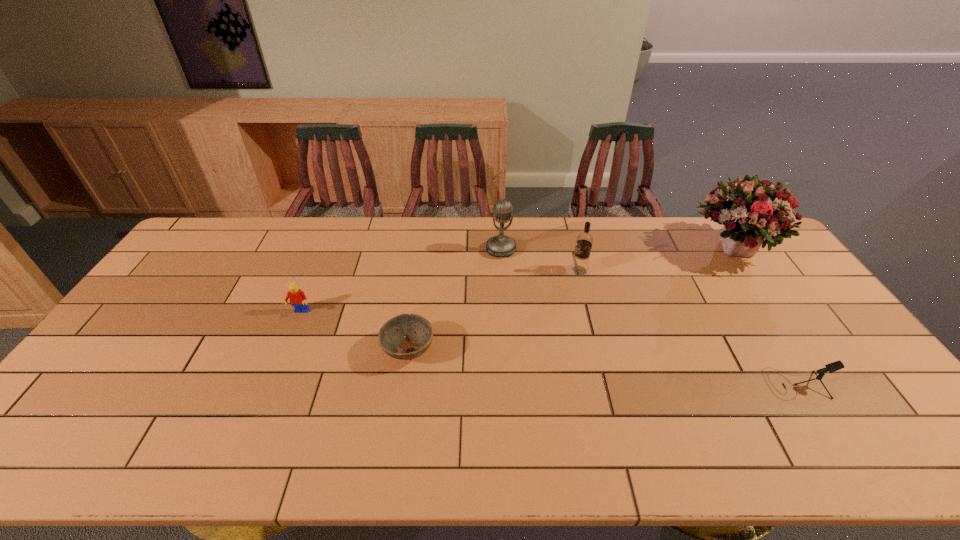
This screenshot has width=960, height=540. Find the location of `vacant area between the tallest object and the leftmost object`. vacant area between the tallest object and the leftmost object is located at coordinates click(515, 281).

I want to click on free space between the fifth object from right to left and the fourth object from left to right, so click(493, 310).

You are a GUI agent. You are given a task and a screenshot of the screen. Output one action in this format:
    pyautogui.click(x=<x>, y=<y>)
    Task: Click on the vacant area that lies between the bowl and the Lego
    Image resolution: width=960 pixels, height=540 pixels.
    Given the screenshot: What is the action you would take?
    pyautogui.click(x=354, y=331)

The image size is (960, 540). I want to click on free point between the right microphone and the Lego, so click(548, 348).

Identify the location of empty location between the nearer microphone and the vodka. The image size is (960, 540). (687, 327).

Where is `empty location between the leftmost object and the vodka`? The height and width of the screenshot is (540, 960). empty location between the leftmost object and the vodka is located at coordinates (440, 291).

Find the location of a particular element. This screenshot has height=540, width=960. empty space that is in between the fourth farthest object and the bouquet is located at coordinates (515, 281).

Locate an element on the screen. blank region between the leftmost object and the fourth object from left to right is located at coordinates click(x=440, y=291).

The height and width of the screenshot is (540, 960). What are the coordinates of `blank region between the tallest object and the shorter microphone` in the screenshot? It's located at (762, 316).

Select which object is the closest to the second object from left to right. Please provide its 2D coordinates. Your answer should be formatted as a tuple, i.e. [(x, y)], where the tuple contains the x and y coordinates of a point satisfying the conditions above.

[(297, 297)]